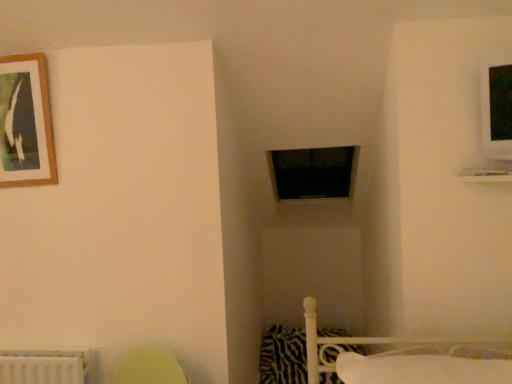
Question: From the image's perspective, is wooden-framed picture at upper left beneath white soft pillow at lower right, the 2th pillow positioned from the bottom?

Choices:
 (A) yes
 (B) no

Answer: (B)

Question: Is white soft pillow at lower right, the 2th pillow positioned from the bottom, a part of wooden-framed picture at upper left?

Choices:
 (A) yes
 (B) no

Answer: (B)

Question: Can you confirm if wooden-framed picture at upper left is bigger than white soft pillow at lower right, marked as the first pillow in a front-to-back arrangement?

Choices:
 (A) no
 (B) yes

Answer: (A)

Question: From the image's perspective, is wooden-framed picture at upper left on top of white soft pillow at lower right, marked as the first pillow in a front-to-back arrangement?

Choices:
 (A) yes
 (B) no

Answer: (A)

Question: Does wooden-framed picture at upper left appear on the left side of white soft pillow at lower right, marked as the first pillow in a front-to-back arrangement?

Choices:
 (A) yes
 (B) no

Answer: (A)

Question: From the image's perspective, is white soft pillow at lower right, which is the second pillow in back-to-front order, located above or below wooden-framed picture at upper left?

Choices:
 (A) below
 (B) above

Answer: (A)

Question: Does point (456, 360) appear closer or farther from the camera than point (30, 99)?

Choices:
 (A) farther
 (B) closer

Answer: (B)

Question: In terms of width, does white soft pillow at lower right, the 2th pillow positioned from the bottom, look wider or thinner when compared to wooden-framed picture at upper left?

Choices:
 (A) wide
 (B) thin

Answer: (A)

Question: Relative to wooden-framed picture at upper left, is white soft pillow at lower right, which is the 1th pillow from top to bottom, in front or behind?

Choices:
 (A) behind
 (B) front

Answer: (B)

Question: From the image's perspective, is wooden-framed picture at upper left positioned above or below zebra-patterned fabric pillow at lower right, positioned as the 1th pillow in back-to-front order?

Choices:
 (A) above
 (B) below

Answer: (A)

Question: Considering the positions of wooden-framed picture at upper left and zebra-patterned fabric pillow at lower right, the 2th pillow viewed from the top, in the image, is wooden-framed picture at upper left taller or shorter than zebra-patterned fabric pillow at lower right, the 2th pillow viewed from the top,?

Choices:
 (A) short
 (B) tall

Answer: (B)

Question: Based on their positions, is wooden-framed picture at upper left located to the left or right of zebra-patterned fabric pillow at lower right, the 1th pillow from the bottom?

Choices:
 (A) right
 (B) left

Answer: (B)

Question: Is point (9, 59) positioned closer to the camera than point (266, 342)?

Choices:
 (A) farther
 (B) closer

Answer: (B)

Question: Is zebra-patterned fabric pillow at lower right, the 1th pillow from the bottom, wider or thinner than black matte window frame at center?

Choices:
 (A) thin
 (B) wide

Answer: (A)

Question: Visually, is zebra-patterned fabric pillow at lower right, the 2th pillow viewed from the top, positioned to the left or to the right of black matte window frame at center?

Choices:
 (A) left
 (B) right

Answer: (A)